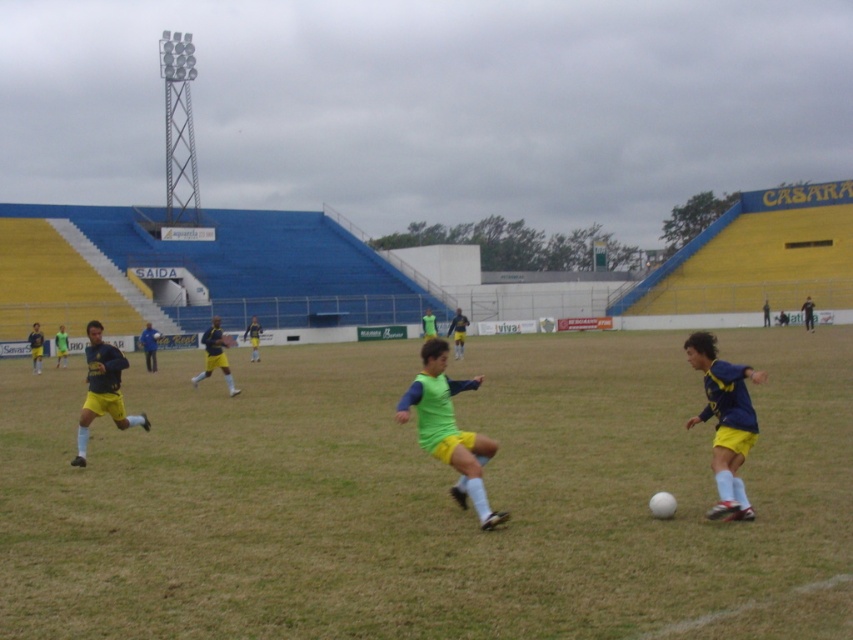
You are a soccer coach analyzing the field layout. You notice the green grass at center and the blue jersey at center. Which object is taller?

The blue jersey at center is taller than the green grass at center.

You are a soccer coach observing the match. You notice the green matte jersey at center and the yellow jersey at left. Which player is shorter in height?

The green matte jersey at center has a lesser height compared to yellow jersey at left, so the player wearing the green matte jersey at center is shorter.

You are a soccer player standing at the point marked by the coordinates (428,497) on the field. Based on the image description, what type of surface are you currently standing on?

The point marked by the coordinates (428,497) is on green grass at center, so you are standing on grass.